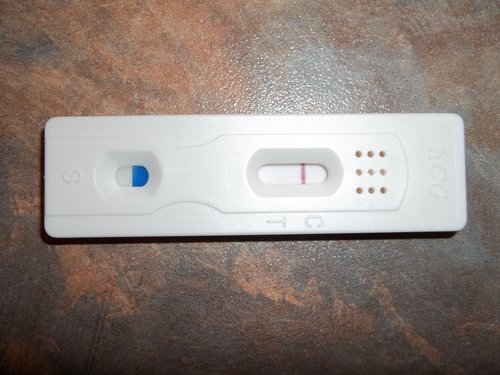
The width and height of the screenshot is (500, 375). In order to click on dark grey paint in this screenshot , I will do `click(432, 268)`.